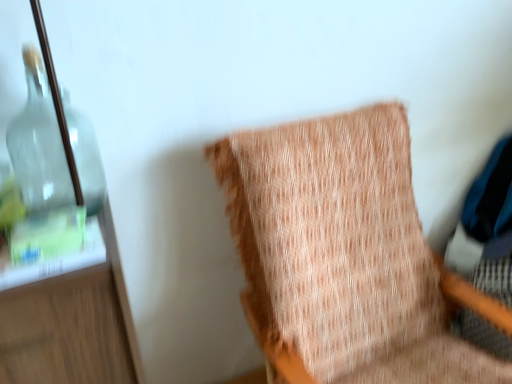
Question: Does textured peach fabric at center come in front of transparent glass bottle at left?

Choices:
 (A) yes
 (B) no

Answer: (A)

Question: Would you say textured peach fabric at center contains transparent glass bottle at left?

Choices:
 (A) no
 (B) yes

Answer: (A)

Question: Can you confirm if textured peach fabric at center is thinner than transparent glass bottle at left?

Choices:
 (A) yes
 (B) no

Answer: (B)

Question: From the image's perspective, is textured peach fabric at center below transparent glass bottle at left?

Choices:
 (A) no
 (B) yes

Answer: (B)

Question: Does textured peach fabric at center have a smaller size compared to transparent glass bottle at left?

Choices:
 (A) no
 (B) yes

Answer: (A)

Question: Does textured peach fabric at center lie behind transparent glass bottle at left?

Choices:
 (A) yes
 (B) no

Answer: (B)

Question: Can textured peach fabric at center be found inside transparent glass bottle at left?

Choices:
 (A) yes
 (B) no

Answer: (B)

Question: Does transparent glass bottle at left lie in front of textured peach fabric at center?

Choices:
 (A) yes
 (B) no

Answer: (B)

Question: Can you confirm if transparent glass bottle at left is thinner than textured peach fabric at center?

Choices:
 (A) yes
 (B) no

Answer: (A)

Question: Does transparent glass bottle at left touch textured peach fabric at center?

Choices:
 (A) no
 (B) yes

Answer: (A)

Question: Is transparent glass bottle at left shorter than textured peach fabric at center?

Choices:
 (A) yes
 (B) no

Answer: (A)

Question: From a real-world perspective, is transparent glass bottle at left positioned over textured peach fabric at center based on gravity?

Choices:
 (A) no
 (B) yes

Answer: (B)

Question: In terms of height, does textured peach fabric at center look taller or shorter compared to transparent glass bottle at left?

Choices:
 (A) short
 (B) tall

Answer: (B)